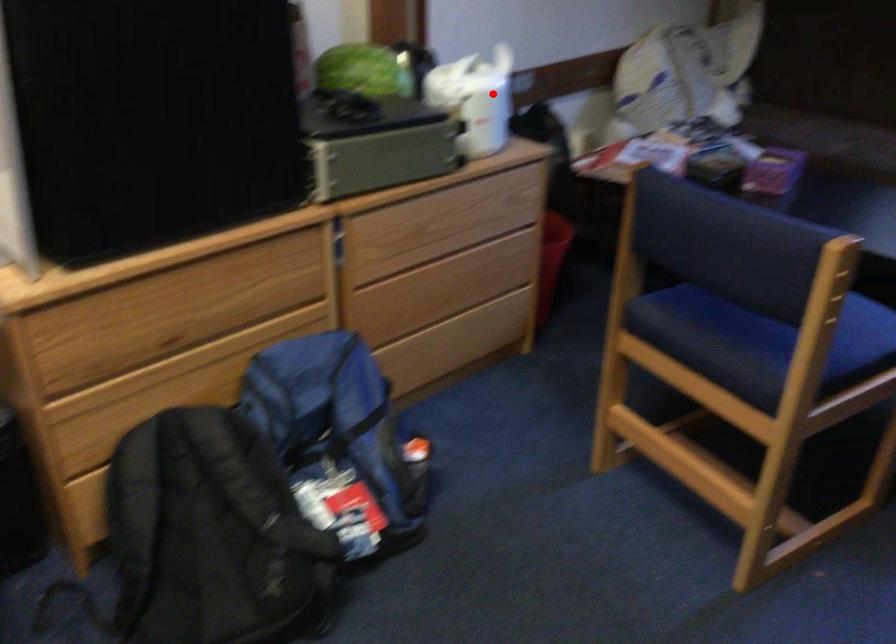
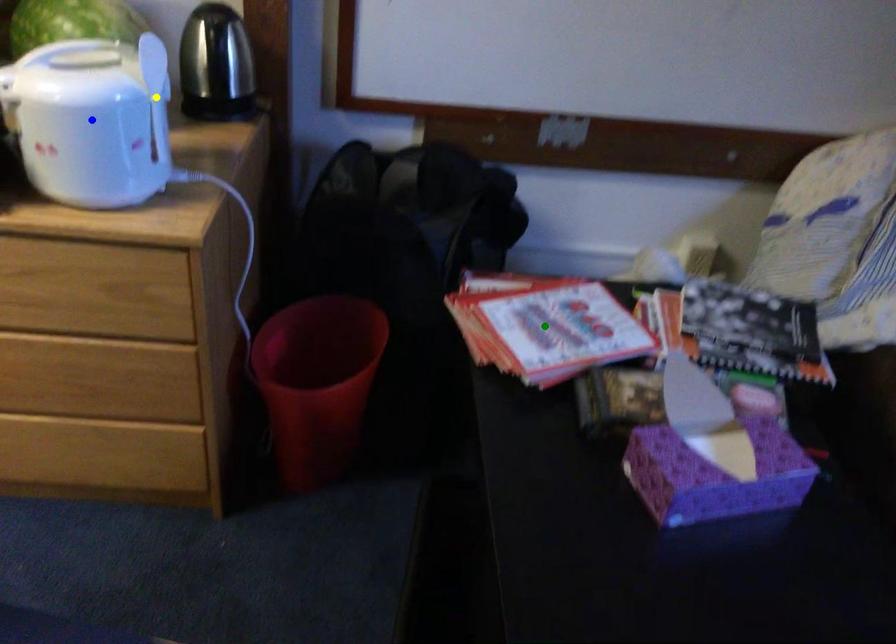
Question: I am providing you with two images of the same scene from different viewpoints. A red point is marked on the first image. You are given multiple points on the second image. Which mark in image 2 goes with the point in image 1?

Choices:
 (A) yellow point
 (B) blue point
 (C) green point

Answer: (B)